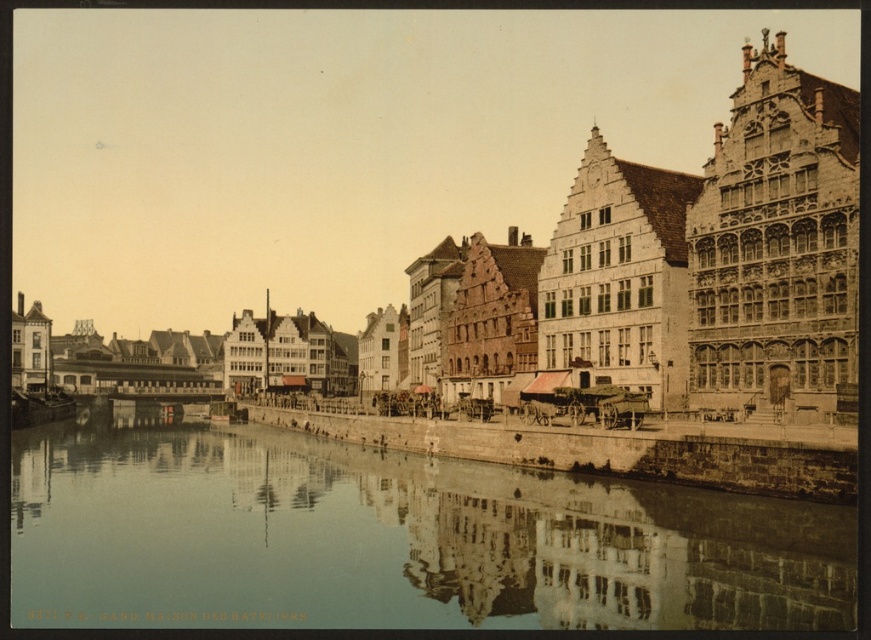
Question: Does stone building at center have a greater width compared to smooth concrete river at center?

Choices:
 (A) no
 (B) yes

Answer: (B)

Question: Is stone building at center further to the viewer compared to smooth concrete river at center?

Choices:
 (A) no
 (B) yes

Answer: (B)

Question: Which point appears closest to the camera in this image?

Choices:
 (A) (525, 506)
 (B) (309, 234)

Answer: (A)

Question: Is stone building at center in front of smooth concrete river at center?

Choices:
 (A) yes
 (B) no

Answer: (B)